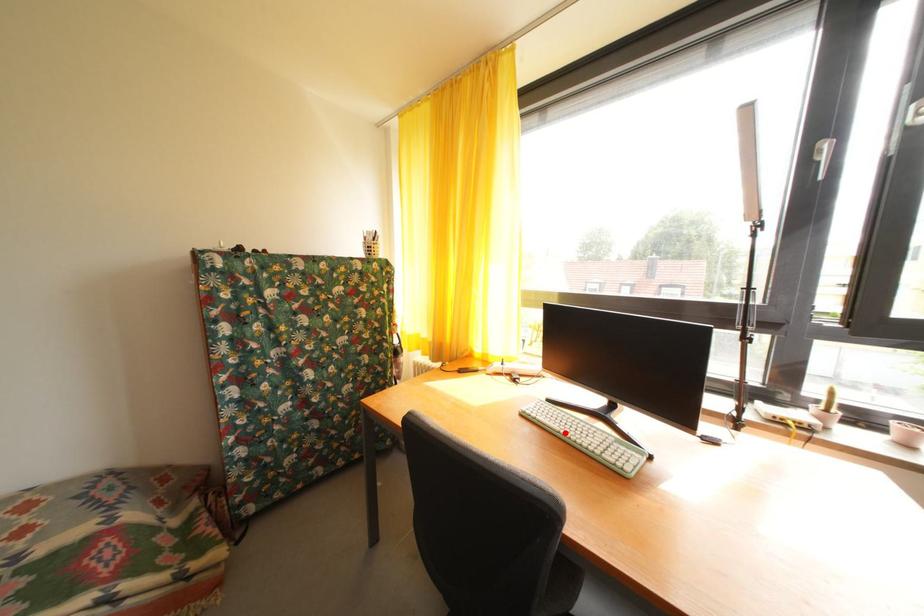
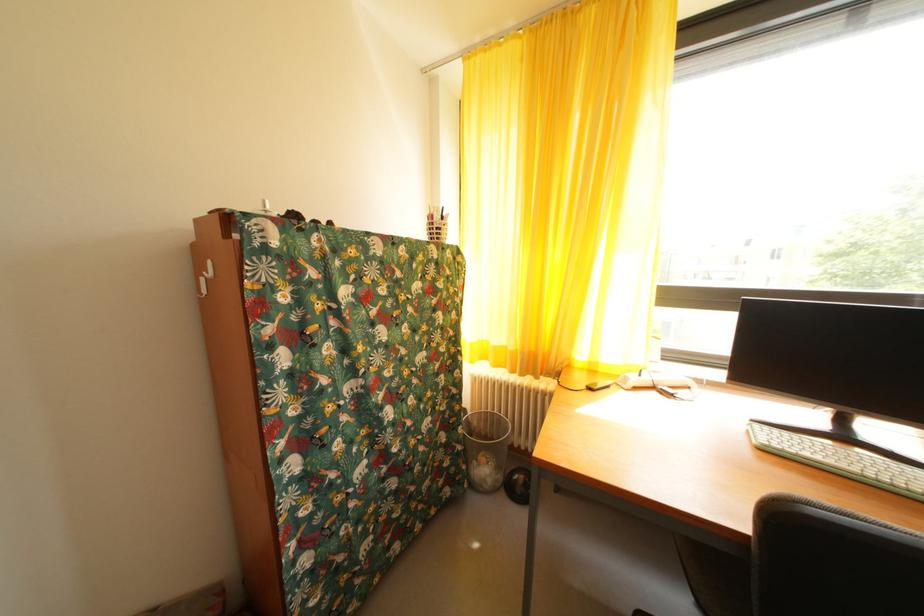
Find the pixel in the second image that matches the highlighted location in the first image.

(854, 472)